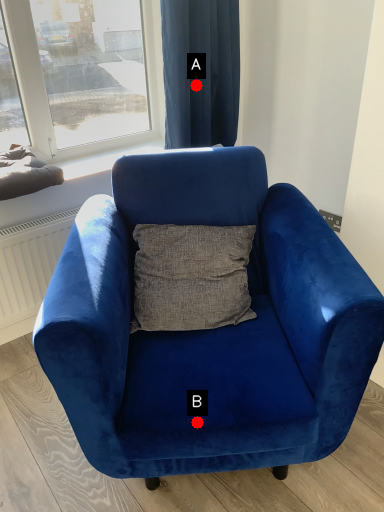
Question: Two points are circled on the image, labeled by A and B beside each circle. Which point is closer to the camera taking this photo?

Choices:
 (A) A is closer
 (B) B is closer

Answer: (B)